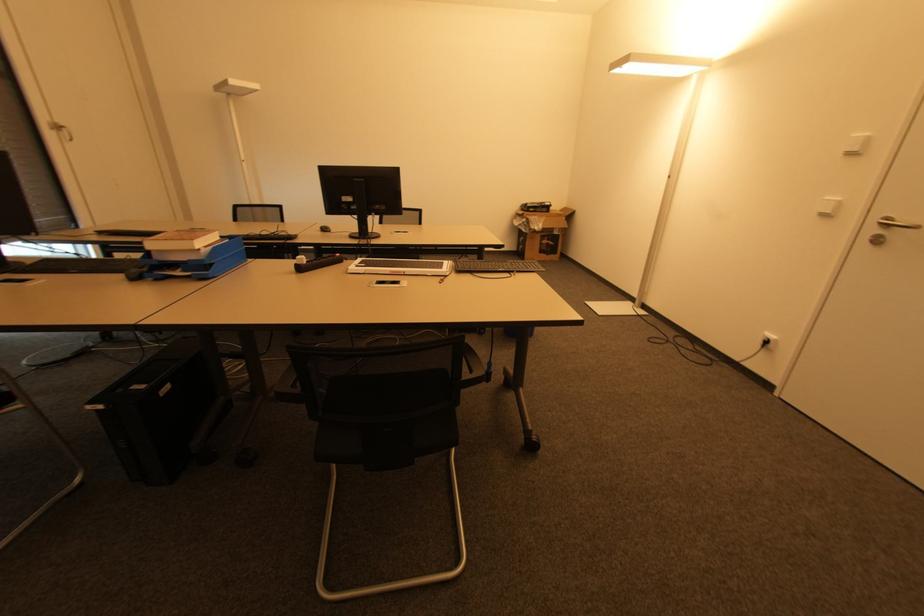
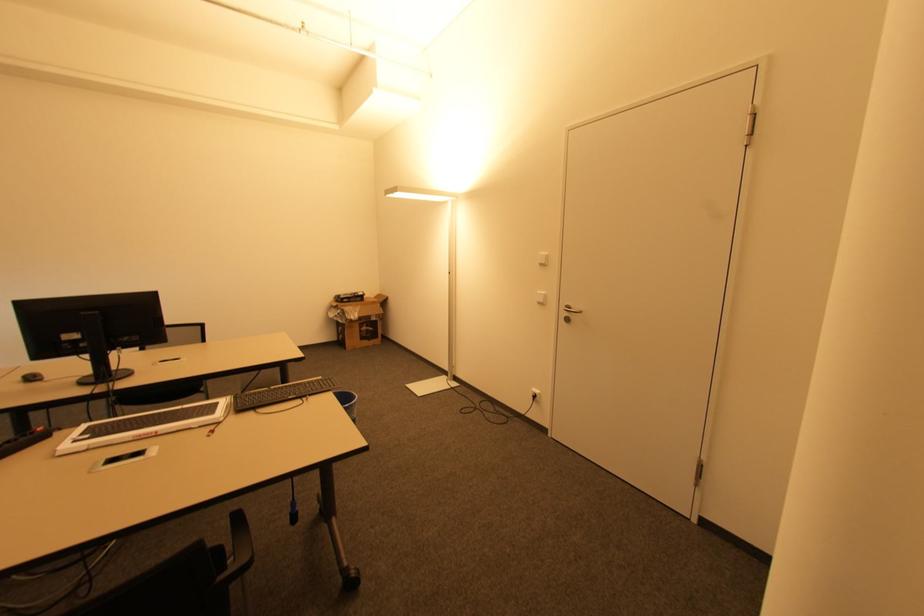
Where in the second image is the point corresponding to point 550,245 from the first image?

(369, 331)